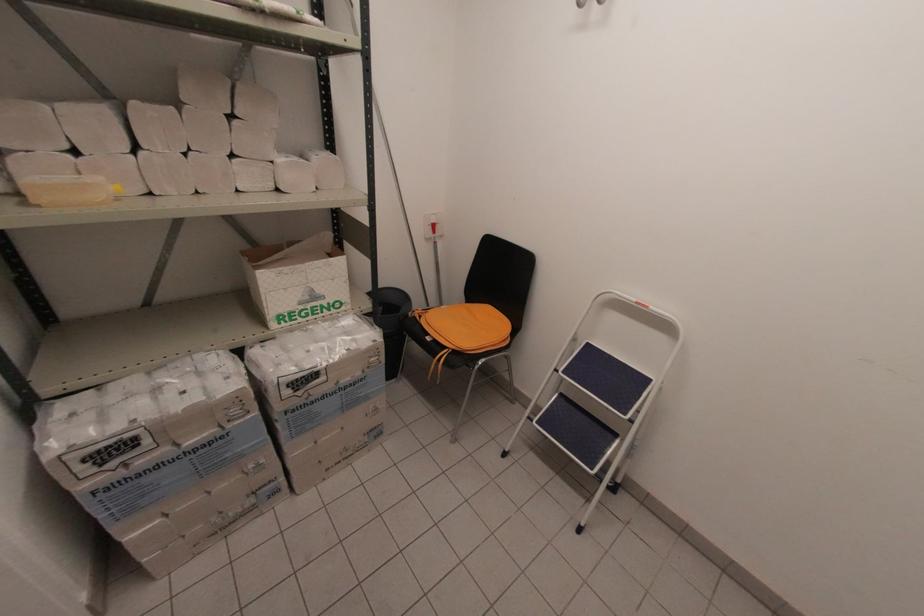
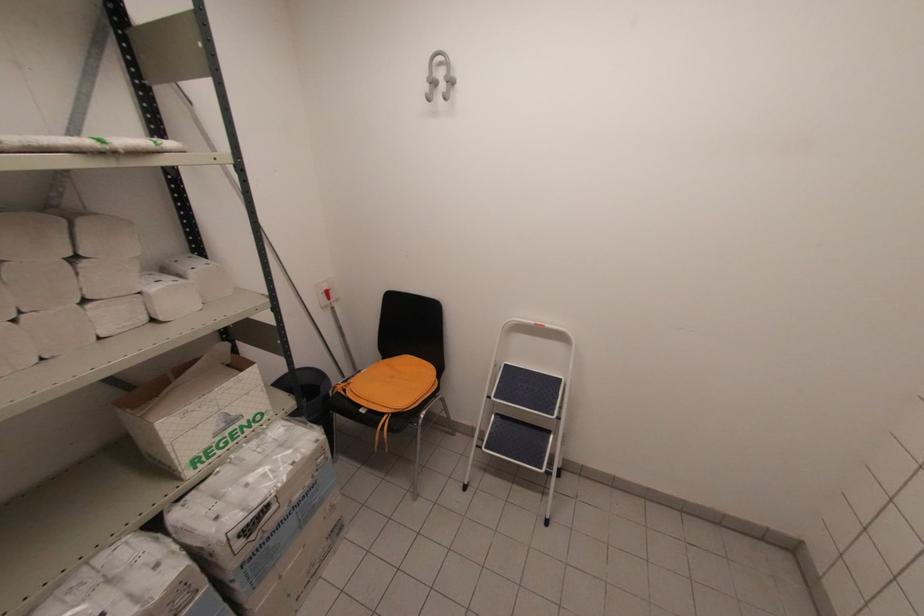
In the second image, find the point that corresponds to point 237,114 in the first image.

(81, 254)